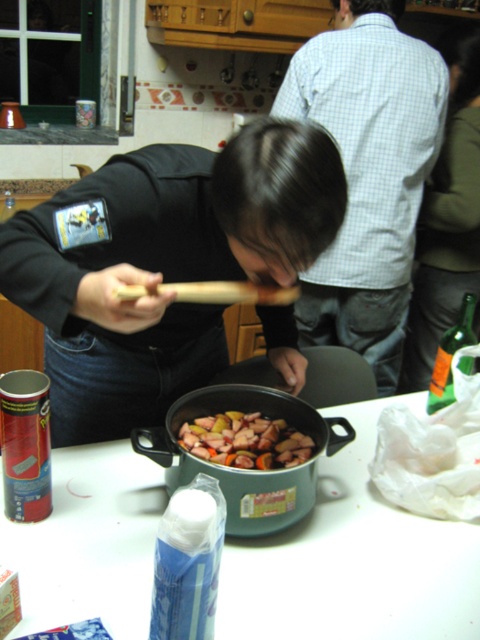
Can you confirm if green fabric shirt at upper right is taller than green matte wok at center?

Indeed, green fabric shirt at upper right has a greater height compared to green matte wok at center.

Can you confirm if green fabric shirt at upper right is smaller than green matte wok at center?

Actually, green fabric shirt at upper right might be larger than green matte wok at center.

At what (x,y) coordinates should I click in order to perform the action: click on green fabric shirt at upper right. Please return your answer as a coordinate pair (x, y). The height and width of the screenshot is (640, 480). Looking at the image, I should click on (447, 216).

Based on the photo, who is higher up, white plastic bag at lower right or shiny metallic pot at center?

shiny metallic pot at center

Is white plastic bag at lower right to the right of shiny metallic pot at center from the viewer's perspective?

Indeed, white plastic bag at lower right is positioned on the right side of shiny metallic pot at center.

Which is behind, point (251, 570) or point (288, 433)?

The point (288, 433) is more distant.

This screenshot has width=480, height=640. In order to click on white plastic bag at lower right in this screenshot , I will do `click(354, 561)`.

Is white plastic bag at lower right below green matte wok at center?

Yes.

Can you confirm if white plastic bag at lower right is positioned above green matte wok at center?

No.

Identify the location of white plastic bag at lower right. The width and height of the screenshot is (480, 640). (354, 561).